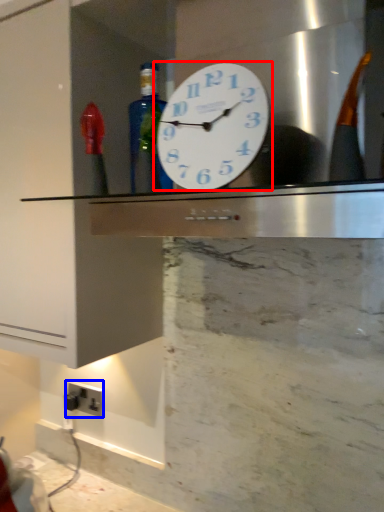
Question: Among these objects, which one is nearest to the camera, wall clock (highlighted by a red box) or electric outlet (highlighted by a blue box)?

Choices:
 (A) wall clock
 (B) electric outlet

Answer: (A)